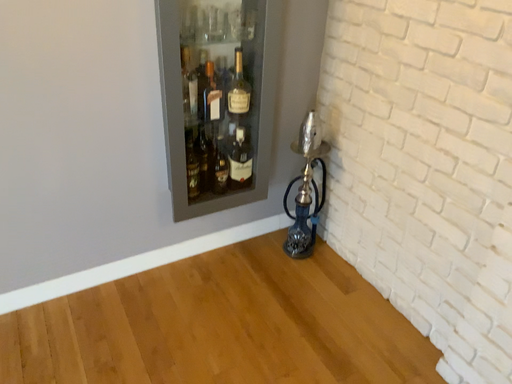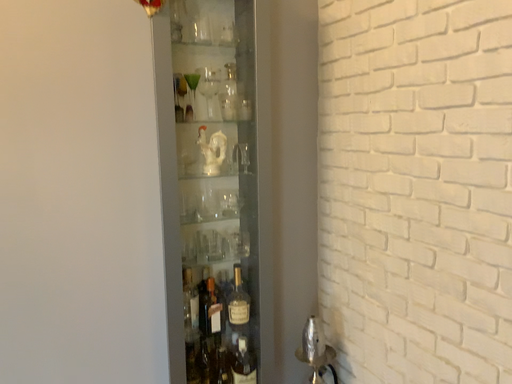
Question: How did the camera likely rotate when shooting the video?

Choices:
 (A) rotated downward
 (B) rotated upward

Answer: (B)